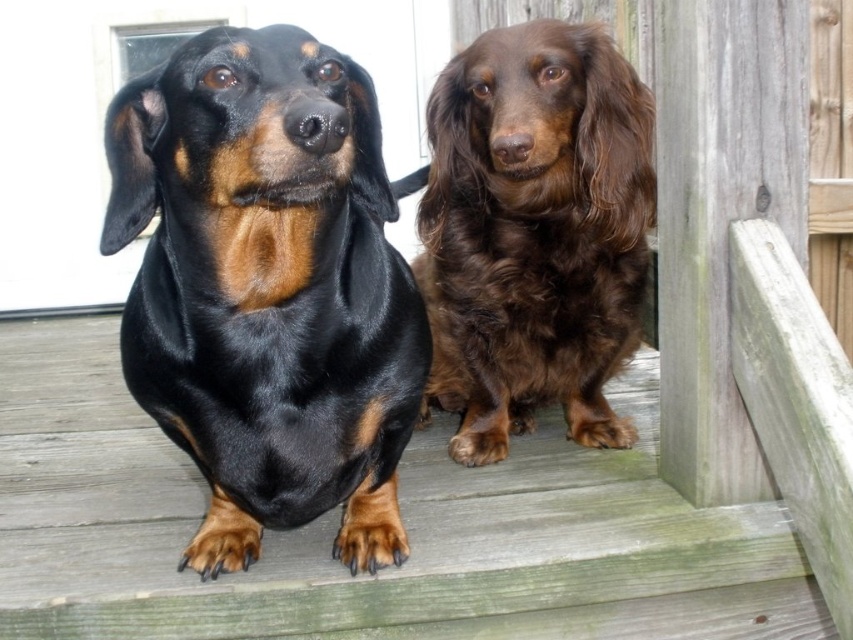
Question: Is black shiny fur dog at center closer to the viewer compared to brown shaggy dog at center?

Choices:
 (A) no
 (B) yes

Answer: (B)

Question: Which point is farther to the camera?

Choices:
 (A) click(x=218, y=77)
 (B) click(x=558, y=64)

Answer: (B)

Question: Can you confirm if black shiny fur dog at center is wider than brown shaggy dog at center?

Choices:
 (A) yes
 (B) no

Answer: (B)

Question: Which object appears farthest from the camera in this image?

Choices:
 (A) brown shaggy dog at center
 (B) black shiny fur dog at center

Answer: (A)

Question: Which object appears farthest from the camera in this image?

Choices:
 (A) black shiny fur dog at center
 (B) brown shaggy dog at center

Answer: (B)

Question: Can you confirm if black shiny fur dog at center is positioned below brown shaggy dog at center?

Choices:
 (A) no
 (B) yes

Answer: (B)